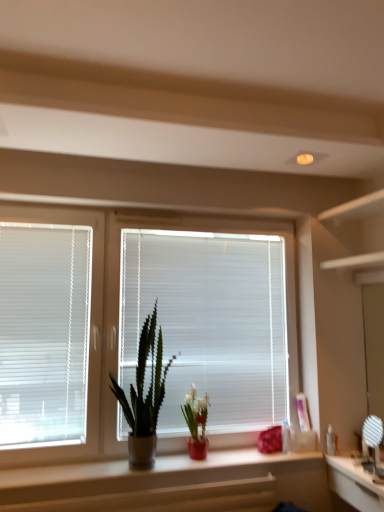
Locate an element on the screen. Image resolution: width=384 pixels, height=512 pixels. vacant area that lies in front of matte red vase at center, which is counted as the second houseplant, starting from the left is located at coordinates (190, 465).